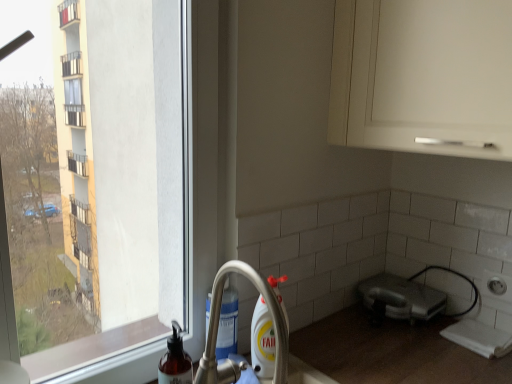
What do you see at coordinates (218, 326) in the screenshot?
I see `silver metallic faucet at lower center` at bounding box center [218, 326].

Where is `satin silver toaster at lower right`? The image size is (512, 384). satin silver toaster at lower right is located at coordinates (401, 298).

Is silver metallic faucet at lower center outside of translucent plastic soap dispenser at lower left?

Yes.

In terms of height, does silver metallic faucet at lower center look taller or shorter compared to translucent plastic soap dispenser at lower left?

Considering their sizes, silver metallic faucet at lower center has more height than translucent plastic soap dispenser at lower left.

Between silver metallic faucet at lower center and translucent plastic soap dispenser at lower left, which one has larger size?

Bigger between the two is silver metallic faucet at lower center.

The height and width of the screenshot is (384, 512). In order to click on cleaning product on the left side of silver metallic faucet at lower center in this screenshot , I will do `click(175, 360)`.

Is translucent plastic soap dispenser at lower left aimed at silver metallic faucet at lower center?

No.

From a real-world perspective, who is located higher, translucent plastic soap dispenser at lower left or silver metallic faucet at lower center?

silver metallic faucet at lower center, from a real-world perspective.

From the picture: Would you say translucent plastic soap dispenser at lower left is inside or outside silver metallic faucet at lower center?

translucent plastic soap dispenser at lower left is spatially situated outside silver metallic faucet at lower center.

Visually, is translucent plastic soap dispenser at lower left positioned to the left or to the right of silver metallic faucet at lower center?

From the image, it's evident that translucent plastic soap dispenser at lower left is to the left of silver metallic faucet at lower center.

From the image's perspective, is translucent plastic soap dispenser at lower left over satin silver toaster at lower right?

Incorrect, from the image's perspective, translucent plastic soap dispenser at lower left is lower than satin silver toaster at lower right.

From a real-world perspective, is translucent plastic soap dispenser at lower left below satin silver toaster at lower right?

No, from a real-world perspective, translucent plastic soap dispenser at lower left is not under satin silver toaster at lower right.

Who is taller, translucent plastic soap dispenser at lower left or satin silver toaster at lower right?

With more height is translucent plastic soap dispenser at lower left.

Would you say translucent plastic soap dispenser at lower left is inside or outside satin silver toaster at lower right?

translucent plastic soap dispenser at lower left exists outside the volume of satin silver toaster at lower right.

Considering the relative positions of silver metallic faucet at lower center and satin silver toaster at lower right in the image provided, is silver metallic faucet at lower center to the right of satin silver toaster at lower right from the viewer's perspective?

No.

From a real-world perspective, between silver metallic faucet at lower center and satin silver toaster at lower right, who is vertically lower?

satin silver toaster at lower right, from a real-world perspective.

Considering the sizes of silver metallic faucet at lower center and satin silver toaster at lower right in the image, is silver metallic faucet at lower center wider or thinner than satin silver toaster at lower right?

silver metallic faucet at lower center is wider than satin silver toaster at lower right.

Considering the points (389, 275) and (206, 345), which point is behind, point (389, 275) or point (206, 345)?

The point (389, 275) is farther from the camera.

Consider the image. Would you say satin silver toaster at lower right is a long distance from silver metallic faucet at lower center?

No.

Which is correct: satin silver toaster at lower right is inside silver metallic faucet at lower center, or outside of it?

satin silver toaster at lower right is not inside silver metallic faucet at lower center, it's outside.

Identify the location of appliance behind the silver metallic faucet at lower center. (401, 298).

Is translucent plastic soap dispenser at lower left inside satin silver toaster at lower right?

No, satin silver toaster at lower right does not contain translucent plastic soap dispenser at lower left.

Can you tell me how much satin silver toaster at lower right and translucent plastic soap dispenser at lower left differ in facing direction?

89.3 degrees separate the facing orientations of satin silver toaster at lower right and translucent plastic soap dispenser at lower left.

Which object is wider, satin silver toaster at lower right or translucent plastic soap dispenser at lower left?

Wider between the two is satin silver toaster at lower right.

Is satin silver toaster at lower right facing away from translucent plastic soap dispenser at lower left?

No, satin silver toaster at lower right is not facing away from translucent plastic soap dispenser at lower left.

Where is `cleaning product behind the silver metallic faucet at lower center`? cleaning product behind the silver metallic faucet at lower center is located at coordinates (175, 360).

Identify the location of tap lying above the translucent plastic soap dispenser at lower left (from the image's perspective). (218, 326).

Estimate the real-world distances between objects in this image. Which object is closer to satin silver toaster at lower right, silver metallic faucet at lower center or translucent plastic soap dispenser at lower left?

silver metallic faucet at lower center is closer to satin silver toaster at lower right.

Considering their positions, is translucent plastic soap dispenser at lower left positioned further to satin silver toaster at lower right than silver metallic faucet at lower center?

translucent plastic soap dispenser at lower left is positioned further to the anchor satin silver toaster at lower right.

Based on their spatial positions, is satin silver toaster at lower right or translucent plastic soap dispenser at lower left further from silver metallic faucet at lower center?

satin silver toaster at lower right is positioned further to the anchor silver metallic faucet at lower center.

Which object lies nearer to the anchor point translucent plastic soap dispenser at lower left, satin silver toaster at lower right or silver metallic faucet at lower center?

The object closer to translucent plastic soap dispenser at lower left is silver metallic faucet at lower center.

Considering their positions, is translucent plastic soap dispenser at lower left positioned further to silver metallic faucet at lower center than satin silver toaster at lower right?

satin silver toaster at lower right is further to silver metallic faucet at lower center.

Which object lies nearer to the anchor point translucent plastic soap dispenser at lower left, silver metallic faucet at lower center or satin silver toaster at lower right?

silver metallic faucet at lower center is closer to translucent plastic soap dispenser at lower left.

You are a GUI agent. You are given a task and a screenshot of the screen. Output one action in this format:
    pyautogui.click(x=<x>, y=<y>)
    Task: Click on the tap between translucent plastic soap dispenser at lower left and satin silver toaster at lower right
    
    Given the screenshot: What is the action you would take?
    click(218, 326)